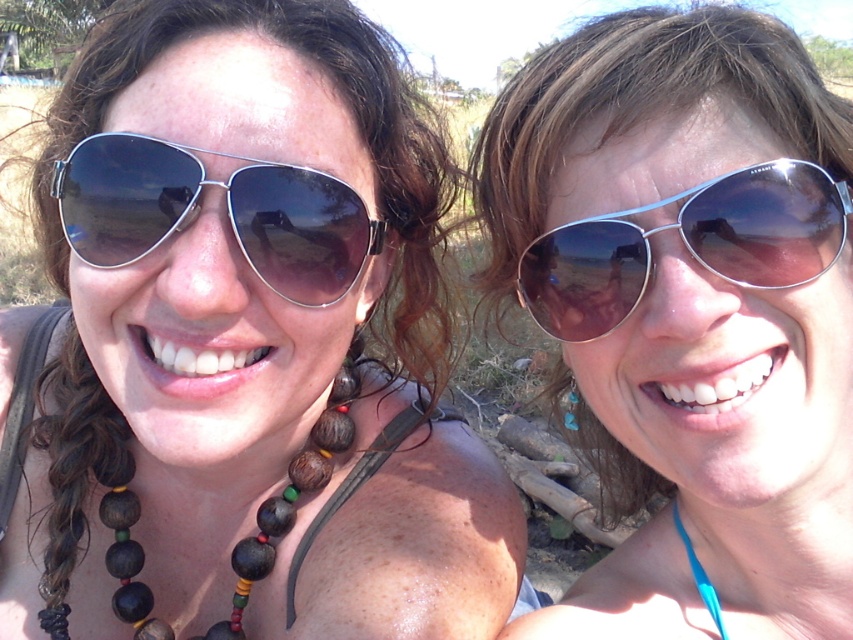
Who is higher up, metal aviator sunglasses at left or metal aviator sunglasses at right?

metal aviator sunglasses at left

Looking at this image, who is positioned more to the left, metal aviator sunglasses at left or metal aviator sunglasses at right?

metal aviator sunglasses at left is more to the left.

Where is `metal aviator sunglasses at left`? The width and height of the screenshot is (853, 640). metal aviator sunglasses at left is located at coordinates (227, 212).

Describe the element at coordinates (248, 340) in the screenshot. I see `matte black sunglasses at upper left` at that location.

Does matte black sunglasses at upper left appear on the left side of wooden beads at left?

Indeed, matte black sunglasses at upper left is positioned on the left side of wooden beads at left.

Describe the element at coordinates (248, 340) in the screenshot. I see `matte black sunglasses at upper left` at that location.

The width and height of the screenshot is (853, 640). I want to click on matte black sunglasses at upper left, so click(248, 340).

Is metal aviator sunglasses at left to the left of wooden beads at left from the viewer's perspective?

Incorrect, metal aviator sunglasses at left is not on the left side of wooden beads at left.

Is point (283, 195) less distant than point (126, 589)?

Yes, point (283, 195) is closer to viewer.

Which is in front, point (108, 156) or point (265, 570)?

Point (108, 156) is more forward.

Identify the location of metal aviator sunglasses at left. (227, 212).